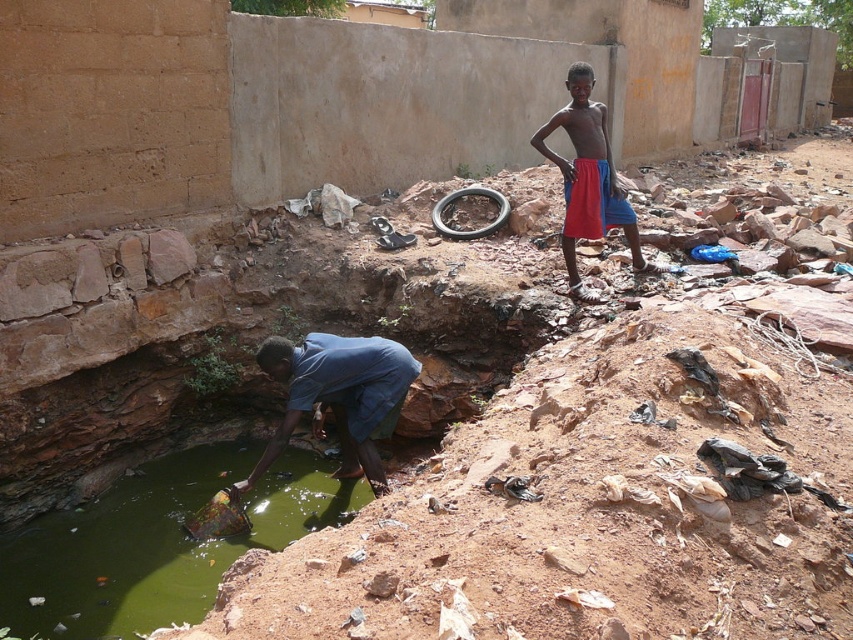
From the picture: Between green murky water at lower left and blue fabric at lower left, which one is positioned higher?

blue fabric at lower left is above.

Where is `green murky water at lower left`? The height and width of the screenshot is (640, 853). green murky water at lower left is located at coordinates (157, 541).

Who is higher up, green murky water at lower left or black rubber tire at center?

black rubber tire at center is higher up.

Who is shorter, green murky water at lower left or black rubber tire at center?

black rubber tire at center

Locate an element on the screen. The image size is (853, 640). green murky water at lower left is located at coordinates (157, 541).

Is blue fabric at lower left below black rubber tire at center?

Indeed, blue fabric at lower left is positioned under black rubber tire at center.

Which is above, blue fabric at lower left or black rubber tire at center?

Positioned higher is black rubber tire at center.

Find the location of `blue fabric at lower left`. blue fabric at lower left is located at coordinates (338, 396).